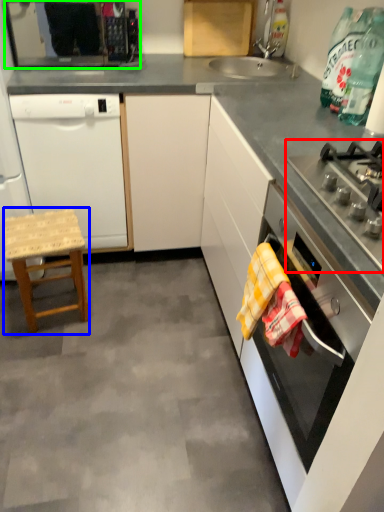
Question: Estimate the real-world distances between objects in this image. Which object is farther from gas stove (highlighted by a red box), stool (highlighted by a blue box) or kitchen appliance (highlighted by a green box)?

Choices:
 (A) stool
 (B) kitchen appliance

Answer: (B)